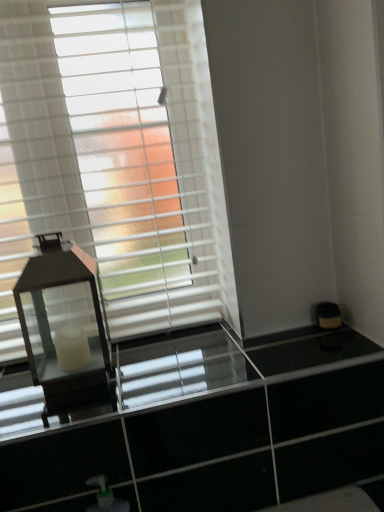
Describe the element at coordinates (64, 326) in the screenshot. I see `matte black lantern at left` at that location.

You are a GUI agent. You are given a task and a screenshot of the screen. Output one action in this format:
    pyautogui.click(x=<x>, y=<y>)
    Task: Click on the matte black lantern at left
    This screenshot has height=512, width=384.
    Given the screenshot: What is the action you would take?
    pyautogui.click(x=64, y=326)

Which of these two, white matte window blind at upper left or clear glass dresser at center, stands taller?

Standing taller between the two is white matte window blind at upper left.

The height and width of the screenshot is (512, 384). I want to click on window blind that appears above the clear glass dresser at center (from the image's perspective), so click(116, 158).

Measure the distance from white matte window blind at upper left to clear glass dresser at center.

white matte window blind at upper left is 48.81 centimeters away from clear glass dresser at center.

Is clear glass dresser at center not close to white matte window blind at upper left?

→ That's not correct — clear glass dresser at center is a little close to white matte window blind at upper left.

Who is bigger, clear glass dresser at center or white matte window blind at upper left?

Bigger between the two is white matte window blind at upper left.

Is clear glass dresser at center not within white matte window blind at upper left?

Yes, clear glass dresser at center is not within white matte window blind at upper left.

Considering the positions of objects clear glass dresser at center and white matte window blind at upper left in the image provided, who is in front, clear glass dresser at center or white matte window blind at upper left?

clear glass dresser at center is closer to the camera.

From a real-world perspective, who is located higher, clear glass dresser at center or matte black lantern at left?

matte black lantern at left.

Does clear glass dresser at center have a greater width compared to matte black lantern at left?

Yes.

How far apart are clear glass dresser at center and matte black lantern at left?

10.28 inches.

Between clear glass dresser at center and matte black lantern at left, which one has larger size?

With larger size is matte black lantern at left.

Is white matte window blind at upper left oriented towards matte black lantern at left?

Yes, white matte window blind at upper left is aimed at matte black lantern at left.

Which is in front, point (208, 79) or point (24, 309)?

Positioned in front is point (208, 79).

From a real-world perspective, is white matte window blind at upper left over matte black lantern at left?

Yes, from a real-world perspective, white matte window blind at upper left is on top of matte black lantern at left.

Between matte black lantern at left and clear glass dresser at center, which one has smaller width?

matte black lantern at left.

From a real-world perspective, is matte black lantern at left under clear glass dresser at center?

Incorrect, from a real-world perspective, matte black lantern at left is higher than clear glass dresser at center.

Can you confirm if matte black lantern at left is positioned to the right of clear glass dresser at center?

→ Incorrect, matte black lantern at left is not on the right side of clear glass dresser at center.

What are the coordinates of `table lamp lying above the clear glass dresser at center (from the image's perspective)` in the screenshot? It's located at (64, 326).

Which object is further away from the camera taking this photo, matte black lantern at left or white matte window blind at upper left?

white matte window blind at upper left is further from the camera.

Is matte black lantern at left to the right of white matte window blind at upper left from the viewer's perspective?

No, matte black lantern at left is not to the right of white matte window blind at upper left.

Considering the relative sizes of matte black lantern at left and white matte window blind at upper left in the image provided, is matte black lantern at left wider than white matte window blind at upper left?

Yes, matte black lantern at left is wider than white matte window blind at upper left.

Between matte black lantern at left and white matte window blind at upper left, which one has smaller size?

matte black lantern at left is smaller.

Image resolution: width=384 pixels, height=512 pixels. I want to click on window blind that appears above the clear glass dresser at center (from a real-world perspective), so click(116, 158).

The image size is (384, 512). What are the coordinates of `dresser below the white matte window blind at upper left (from the image's perspective)` in the screenshot? It's located at (214, 428).

Looking at this image, which object lies further to the anchor point white matte window blind at upper left, matte black lantern at left or clear glass dresser at center?

clear glass dresser at center.

Based on the photo, estimate the real-world distances between objects in this image. Which object is further from clear glass dresser at center, white matte window blind at upper left or matte black lantern at left?

white matte window blind at upper left is further to clear glass dresser at center.

Looking at the image, which one is located closer to matte black lantern at left, clear glass dresser at center or white matte window blind at upper left?

clear glass dresser at center is closer to matte black lantern at left.

Which object lies nearer to the anchor point white matte window blind at upper left, clear glass dresser at center or matte black lantern at left?

The object closer to white matte window blind at upper left is matte black lantern at left.

From the image, which object appears to be nearer to matte black lantern at left, white matte window blind at upper left or clear glass dresser at center?

The object closer to matte black lantern at left is clear glass dresser at center.

Looking at the image, which one is located closer to clear glass dresser at center, matte black lantern at left or white matte window blind at upper left?

Among the two, matte black lantern at left is located nearer to clear glass dresser at center.

You are a GUI agent. You are given a task and a screenshot of the screen. Output one action in this format:
    pyautogui.click(x=<x>, y=<y>)
    Task: Click on the table lamp that lies between white matte window blind at upper left and clear glass dresser at center from top to bottom
    
    Given the screenshot: What is the action you would take?
    pyautogui.click(x=64, y=326)